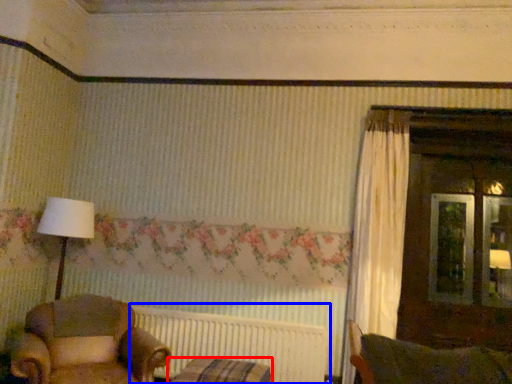
Question: Which point is further to the camera, furniture (highlighted by a red box) or radiator (highlighted by a blue box)?

Choices:
 (A) furniture
 (B) radiator

Answer: (B)